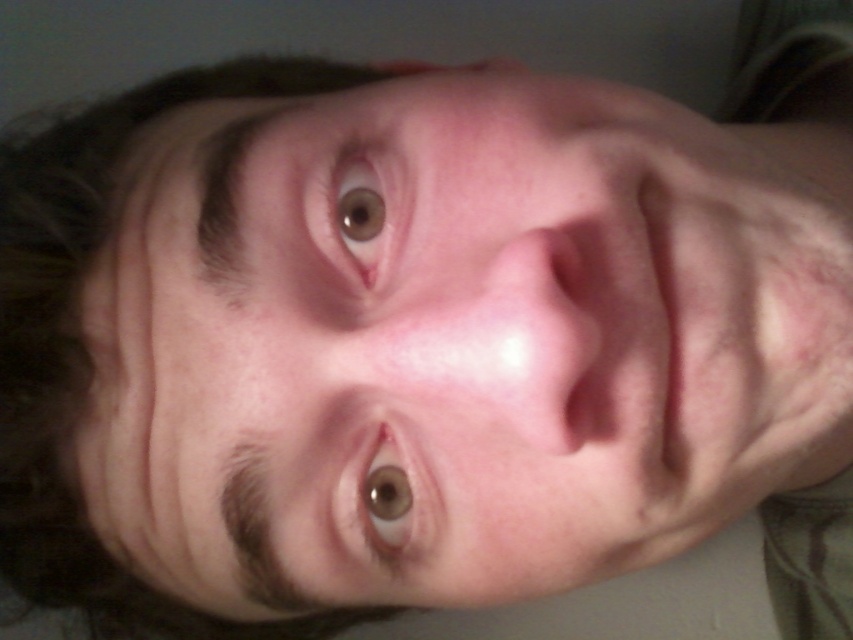
Question: Is dark brown hair at upper left wider than brown matte eye at center?

Choices:
 (A) yes
 (B) no

Answer: (A)

Question: Which point is farther to the camera?

Choices:
 (A) (338, 168)
 (B) (3, 572)

Answer: (B)

Question: Which point is closer to the camera taking this photo?

Choices:
 (A) (343, 264)
 (B) (7, 372)
 (C) (364, 528)

Answer: (A)

Question: Does dark brown hair at upper left appear on the right side of brown matte eye at upper center?

Choices:
 (A) no
 (B) yes

Answer: (A)

Question: Does dark brown hair at upper left have a lesser width compared to brown matte eye at upper center?

Choices:
 (A) yes
 (B) no

Answer: (B)

Question: Which object appears closest to the camera in this image?

Choices:
 (A) brown matte eye at center
 (B) dark brown hair at upper left

Answer: (A)